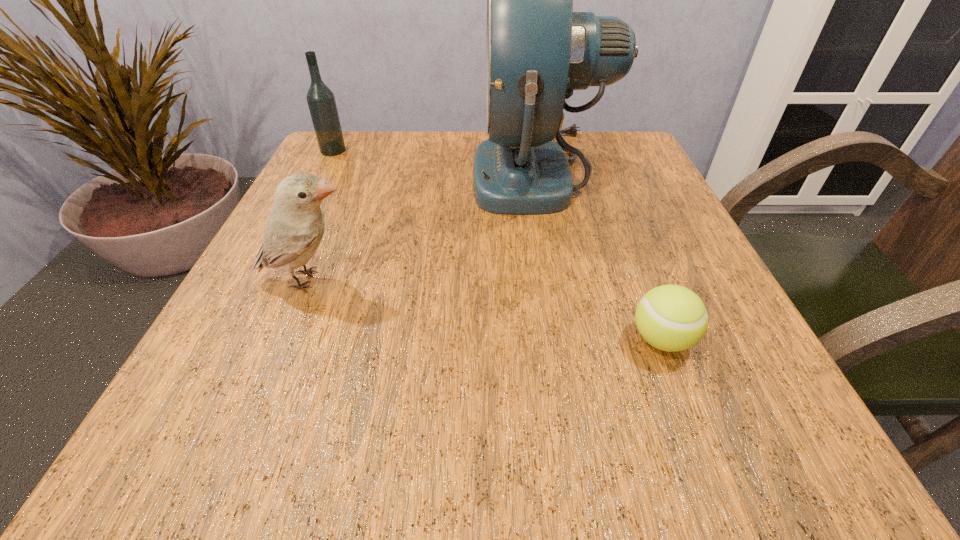
Locate an element on the screen. Image resolution: width=960 pixels, height=540 pixels. fan is located at coordinates (538, 50).

In order to click on vodka in this screenshot , I will do `click(321, 101)`.

Identify the location of bird. (295, 226).

This screenshot has height=540, width=960. I want to click on the shortest object, so click(x=672, y=318).

Find the location of a particular element. The image size is (960, 540). the nearest object is located at coordinates (672, 318).

The image size is (960, 540). Find the location of `free region located in front of the fan to blow air`. free region located in front of the fan to blow air is located at coordinates (330, 174).

Where is `free space located 0.360m in front of the fan to blow air`? free space located 0.360m in front of the fan to blow air is located at coordinates (307, 174).

Where is `free space located in front of the fan to blow air`? This screenshot has height=540, width=960. free space located in front of the fan to blow air is located at coordinates click(x=348, y=174).

The height and width of the screenshot is (540, 960). What are the coordinates of `free space located 0.250m on the front of the vodka` in the screenshot? It's located at (298, 220).

At what (x,y) coordinates should I click in order to perform the action: click on free space located at the face of the bird. Please return your answer as a coordinate pair (x, y). Looking at the image, I should click on (416, 280).